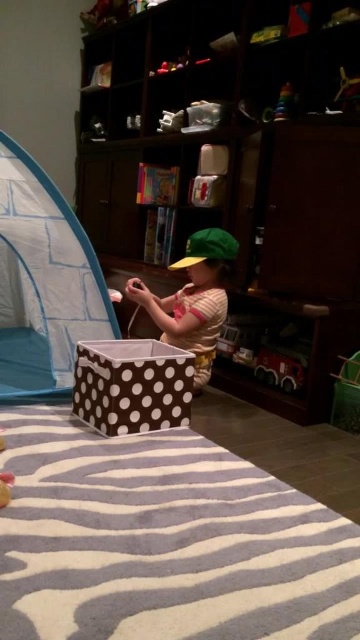
Can you confirm if blue fabric tent at center is thinner than shiny red plastic toy car at lower right?

Incorrect, blue fabric tent at center's width is not less than shiny red plastic toy car at lower right's.

Looking at this image, does blue fabric tent at center appear under shiny red plastic toy car at lower right?

No.

Is point (73, 269) farther from camera compared to point (254, 358)?

That is False.

The height and width of the screenshot is (640, 360). Identify the location of blue fabric tent at center. (43, 282).

Does point (124, 394) lie in front of point (275, 104)?

Yes, it is in front of point (275, 104).

Is point (181, 356) less distant than point (294, 104)?

Yes.

Identify the location of brown dotted fabric box at center. (132, 385).

Can you confirm if brown cardboard bookshelf at center is shorter than green fabric toddler at center?

No.

Where is `brown cardboard bookshelf at center`? The image size is (360, 640). brown cardboard bookshelf at center is located at coordinates (236, 173).

Where is `brown cardboard bookshelf at center`? brown cardboard bookshelf at center is located at coordinates (236, 173).